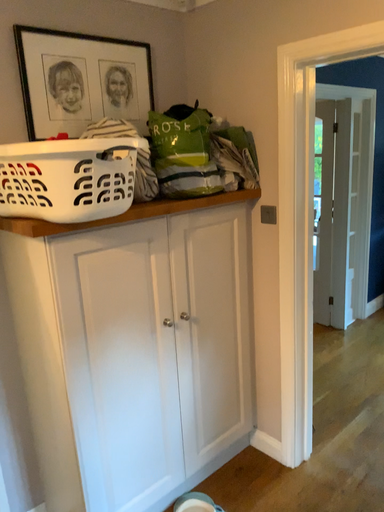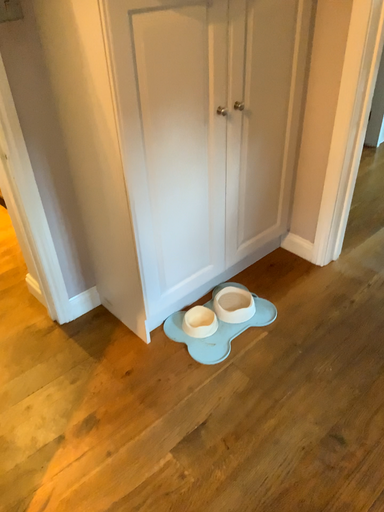
Question: Which way did the camera rotate in the video?

Choices:
 (A) rotated downward
 (B) rotated upward

Answer: (A)